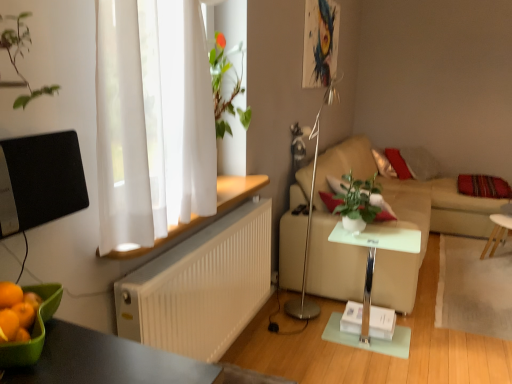
Where is `vacant region to the left of white wooden table at right, the second table positioned from the front`? The width and height of the screenshot is (512, 384). vacant region to the left of white wooden table at right, the second table positioned from the front is located at coordinates (449, 262).